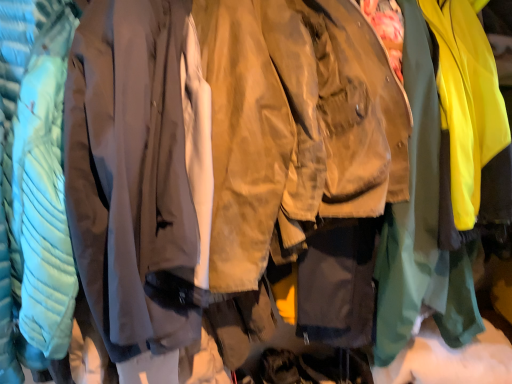
Question: In terms of height, does matte gray sweatshirt at center, the second sweatshirt when ordered from right to left, look taller or shorter compared to tan suede jacket at center, the 1th sweatshirt viewed from the right?

Choices:
 (A) short
 (B) tall

Answer: (B)

Question: Considering the positions of matte gray sweatshirt at center, the second sweatshirt when ordered from right to left, and tan suede jacket at center, the 1th sweatshirt viewed from the right, in the image, is matte gray sweatshirt at center, the second sweatshirt when ordered from right to left, wider or thinner than tan suede jacket at center, the 1th sweatshirt viewed from the right,?

Choices:
 (A) thin
 (B) wide

Answer: (A)

Question: Considering the relative positions of matte gray sweatshirt at center, the second sweatshirt when ordered from right to left, and tan suede jacket at center, the 1th sweatshirt viewed from the right, in the image provided, is matte gray sweatshirt at center, the second sweatshirt when ordered from right to left, to the left or to the right of tan suede jacket at center, the 1th sweatshirt viewed from the right,?

Choices:
 (A) left
 (B) right

Answer: (A)

Question: Considering the positions of point (345, 158) and point (174, 152), is point (345, 158) closer or farther from the camera than point (174, 152)?

Choices:
 (A) farther
 (B) closer

Answer: (A)

Question: Is tan suede jacket at center, placed as the 2th sweatshirt when sorted from left to right, situated inside matte gray sweatshirt at center, acting as the 1th sweatshirt starting from the left, or outside?

Choices:
 (A) outside
 (B) inside

Answer: (A)

Question: Considering the positions of tan suede jacket at center, placed as the 2th sweatshirt when sorted from left to right, and matte gray sweatshirt at center, acting as the 1th sweatshirt starting from the left, in the image, is tan suede jacket at center, placed as the 2th sweatshirt when sorted from left to right, wider or thinner than matte gray sweatshirt at center, acting as the 1th sweatshirt starting from the left,?

Choices:
 (A) thin
 (B) wide

Answer: (B)

Question: From the image's perspective, is tan suede jacket at center, the 1th sweatshirt viewed from the right, above or below matte gray sweatshirt at center, the second sweatshirt when ordered from right to left?

Choices:
 (A) below
 (B) above

Answer: (B)